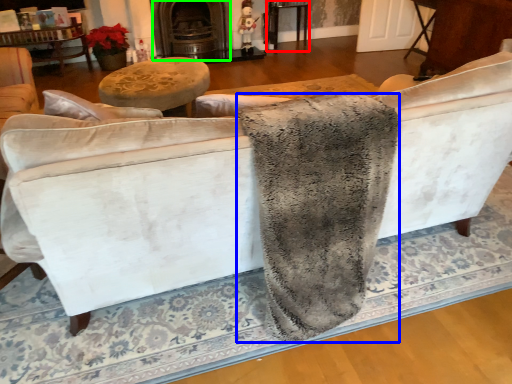
Question: Estimate the real-world distances between objects in this image. Which object is closer to table (highlighted by a red box), blanket (highlighted by a blue box) or fireplace (highlighted by a green box)?

Choices:
 (A) blanket
 (B) fireplace

Answer: (B)